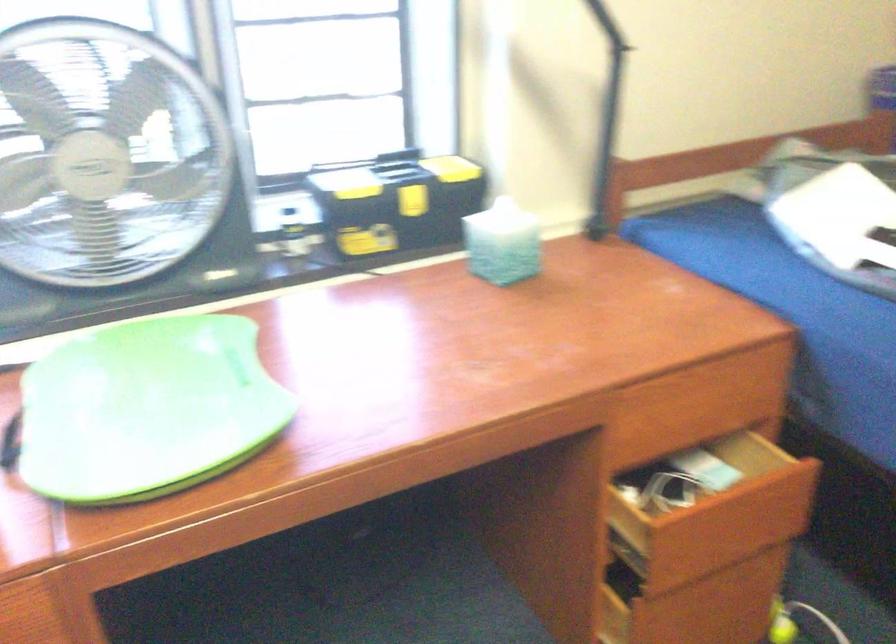
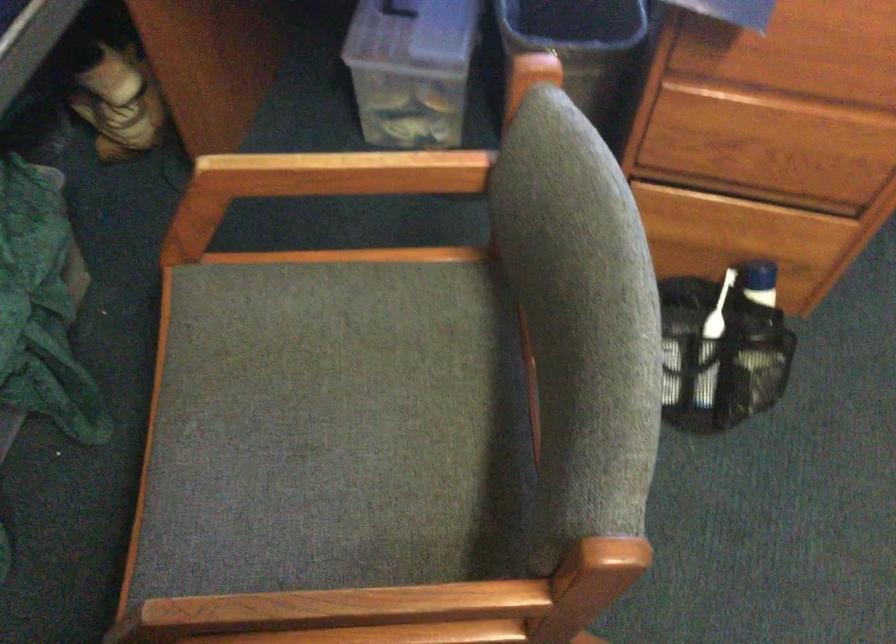
How did the camera likely rotate?

The rotation direction of the camera is left-down.